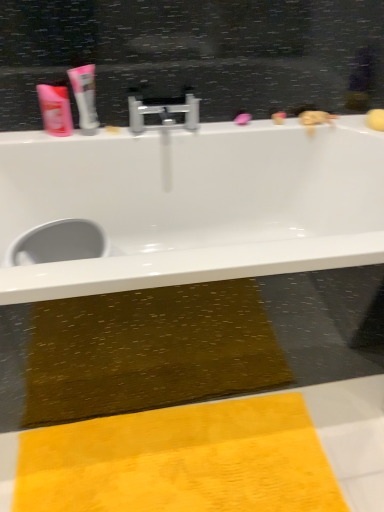
Locate an element on the screen. The height and width of the screenshot is (512, 384). free spot above yellow textured towel at lower center (from a real-world perspective) is located at coordinates (193, 459).